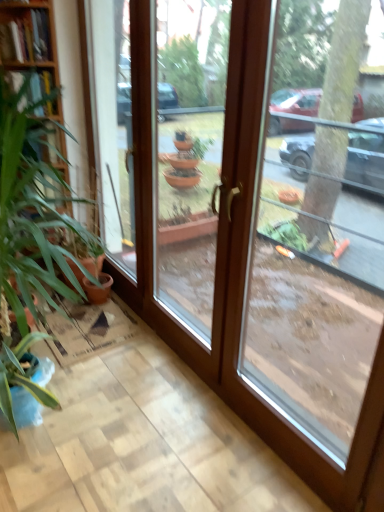
Question: Is wooden bookshelf at left not within transparent glass door at right, acting as the 2th window starting from the left?

Choices:
 (A) yes
 (B) no

Answer: (A)

Question: From a real-world perspective, is wooden bookshelf at left positioned under transparent glass door at right, positioned as the 1th window in right-to-left order, based on gravity?

Choices:
 (A) yes
 (B) no

Answer: (B)

Question: From the image's perspective, is wooden bookshelf at left on top of transparent glass door at right, acting as the 2th window starting from the left?

Choices:
 (A) yes
 (B) no

Answer: (A)

Question: From a real-world perspective, is wooden bookshelf at left on top of transparent glass door at right, positioned as the 1th window in right-to-left order?

Choices:
 (A) yes
 (B) no

Answer: (A)

Question: Is wooden bookshelf at left taller than transparent glass door at right, positioned as the 1th window in right-to-left order?

Choices:
 (A) no
 (B) yes

Answer: (A)

Question: Is point (168, 189) positioned closer to the camera than point (241, 198)?

Choices:
 (A) closer
 (B) farther

Answer: (B)

Question: Is transparent glass door at center, positioned as the 2th window in right-to-left order, to the left or to the right of transparent glass door at right, acting as the 2th window starting from the left, in the image?

Choices:
 (A) right
 (B) left

Answer: (B)

Question: Looking at the image, does transparent glass door at center, positioned as the 2th window in right-to-left order, seem bigger or smaller compared to transparent glass door at right, positioned as the 1th window in right-to-left order?

Choices:
 (A) small
 (B) big

Answer: (A)

Question: From the image's perspective, relative to transparent glass door at right, positioned as the 1th window in right-to-left order, is transparent glass door at center, positioned as the 2th window in right-to-left order, above or below?

Choices:
 (A) below
 (B) above

Answer: (B)

Question: In terms of height, does wooden bookshelf at left look taller or shorter compared to transparent glass door at center, the first window when ordered from left to right?

Choices:
 (A) tall
 (B) short

Answer: (B)

Question: From the image's perspective, relative to transparent glass door at center, the first window when ordered from left to right, is wooden bookshelf at left above or below?

Choices:
 (A) below
 (B) above

Answer: (B)

Question: In terms of width, does wooden bookshelf at left look wider or thinner when compared to transparent glass door at center, positioned as the 2th window in right-to-left order?

Choices:
 (A) thin
 (B) wide

Answer: (B)

Question: Does point (44, 31) appear closer or farther from the camera than point (195, 291)?

Choices:
 (A) farther
 (B) closer

Answer: (B)

Question: Is point (218, 29) positioned closer to the camera than point (8, 96)?

Choices:
 (A) farther
 (B) closer

Answer: (A)

Question: From a real-world perspective, is transparent glass door at center, positioned as the 2th window in right-to-left order, above or below green leafy plant at left?

Choices:
 (A) below
 (B) above

Answer: (B)